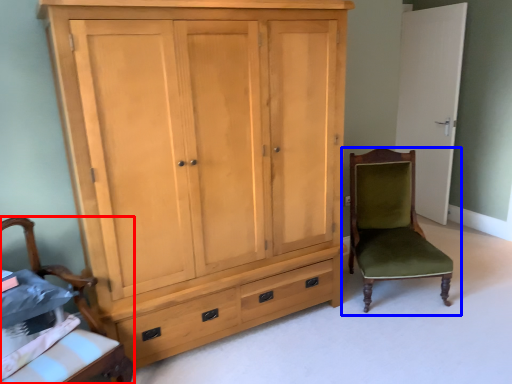
Question: Which object is further to the camera taking this photo, chair (highlighted by a red box) or chair (highlighted by a blue box)?

Choices:
 (A) chair
 (B) chair

Answer: (B)